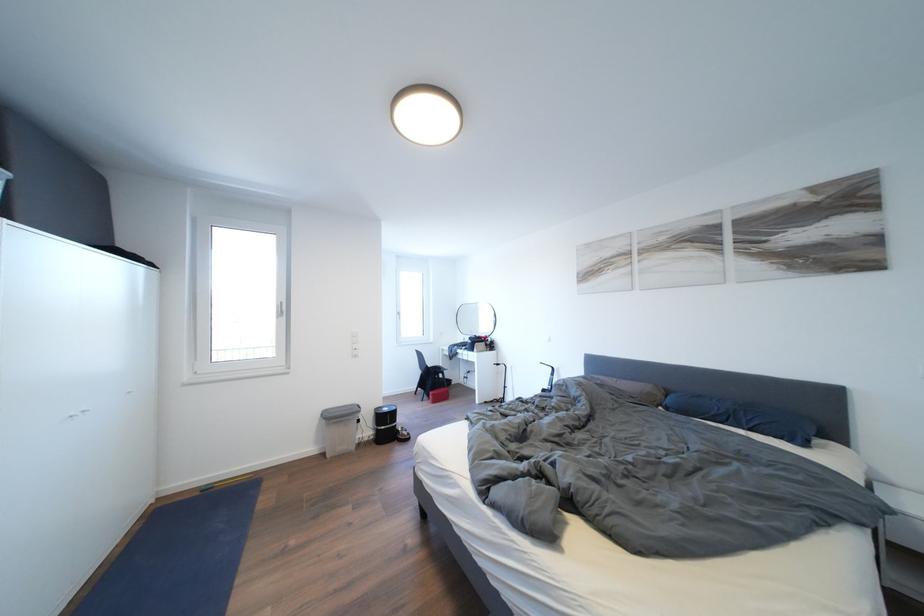
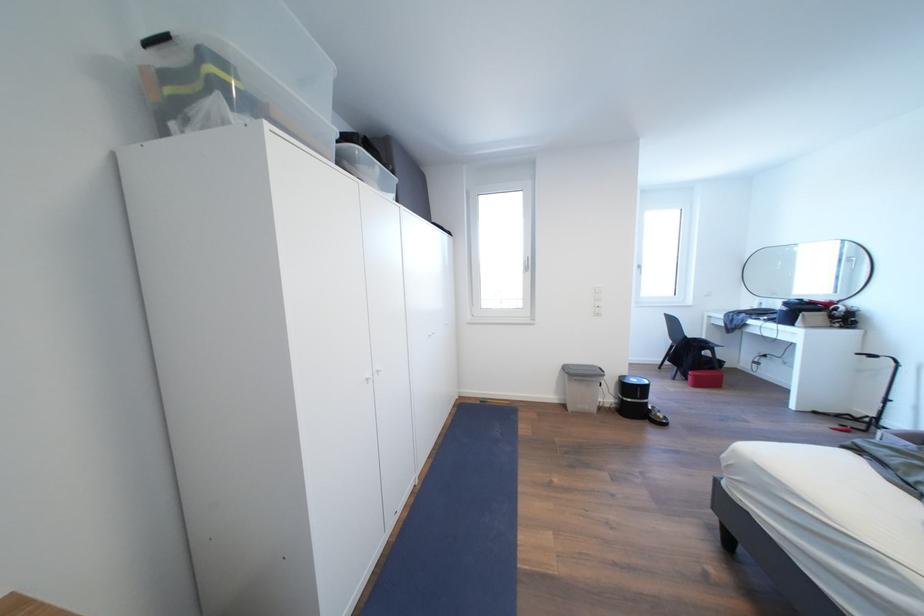
The point at (x=394, y=414) is marked in the first image. Where is the corresponding point in the second image?

(641, 386)